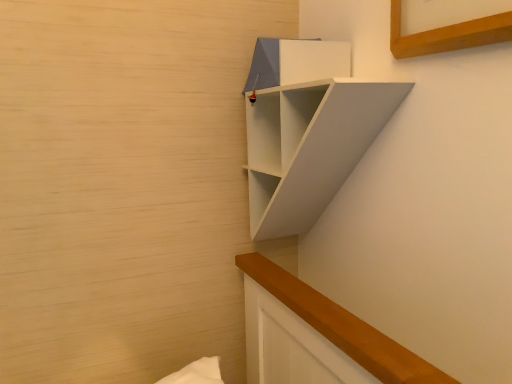
Question: From a real-world perspective, does white matte shelf at upper right stand above matte white cabinet at upper center?

Choices:
 (A) no
 (B) yes

Answer: (A)

Question: Is matte white cabinet at upper center at the back of white matte shelf at upper right?

Choices:
 (A) yes
 (B) no

Answer: (A)

Question: Is white matte shelf at upper right behind matte white cabinet at upper center?

Choices:
 (A) yes
 (B) no

Answer: (B)

Question: Is white matte shelf at upper right facing towards matte white cabinet at upper center?

Choices:
 (A) yes
 (B) no

Answer: (B)

Question: From the image's perspective, is white matte shelf at upper right on top of matte white cabinet at upper center?

Choices:
 (A) yes
 (B) no

Answer: (B)

Question: Considering the relative sizes of white matte shelf at upper right and matte white cabinet at upper center in the image provided, is white matte shelf at upper right bigger than matte white cabinet at upper center?

Choices:
 (A) yes
 (B) no

Answer: (A)

Question: Is matte white cabinet at upper center located outside white matte shelf at upper right?

Choices:
 (A) yes
 (B) no

Answer: (B)

Question: Considering the relative sizes of matte white cabinet at upper center and white matte shelf at upper right in the image provided, is matte white cabinet at upper center wider than white matte shelf at upper right?

Choices:
 (A) yes
 (B) no

Answer: (B)

Question: From a real-world perspective, is matte white cabinet at upper center on white matte shelf at upper right?

Choices:
 (A) yes
 (B) no

Answer: (A)

Question: Is matte white cabinet at upper center at the left side of white matte shelf at upper right?

Choices:
 (A) no
 (B) yes

Answer: (B)

Question: Is matte white cabinet at upper center taller than white matte shelf at upper right?

Choices:
 (A) no
 (B) yes

Answer: (A)

Question: Is matte white cabinet at upper center bigger than white matte shelf at upper right?

Choices:
 (A) no
 (B) yes

Answer: (A)

Question: Which is correct: white matte shelf at upper right is inside matte white cabinet at upper center, or outside of it?

Choices:
 (A) inside
 (B) outside

Answer: (B)